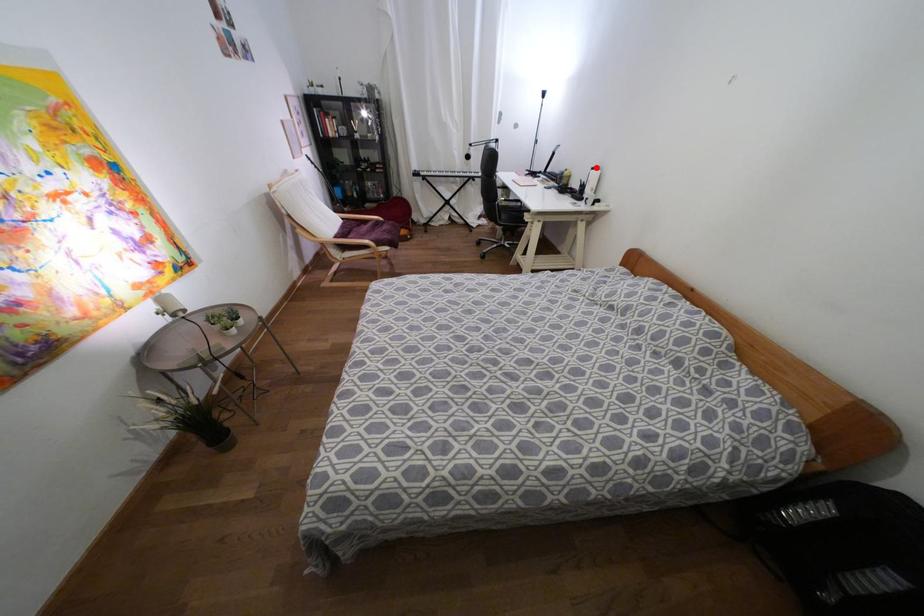
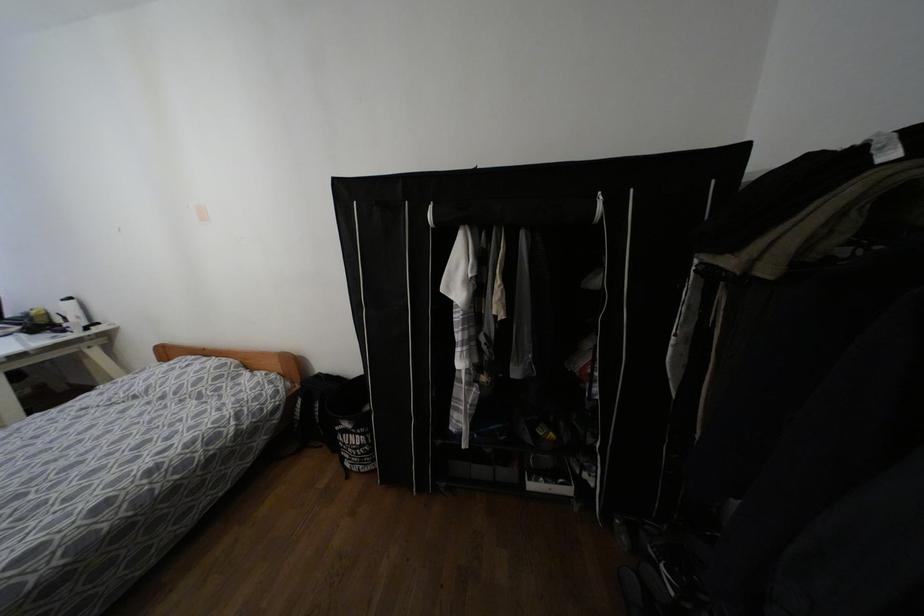
Question: I am providing you with two images of the same scene from different viewpoints. In image1, a red point is highlighted. Considering the same 3D point in image2, which of the following is correct?

Choices:
 (A) It is closer
 (B) It is farther

Answer: (B)